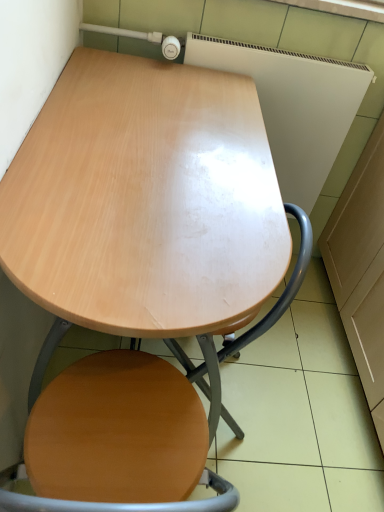
This screenshot has height=512, width=384. What do you see at coordinates (137, 265) in the screenshot?
I see `light wood table at center` at bounding box center [137, 265].

The width and height of the screenshot is (384, 512). I want to click on light wood table at center, so click(x=137, y=265).

In order to face light wood table at center, should I rotate leftwards or rightwards?

Turn left by 6.447 degrees to look at light wood table at center.

What do you see at coordinates (283, 292) in the screenshot? The height and width of the screenshot is (512, 384). I see `wooden swivel chair at center` at bounding box center [283, 292].

The image size is (384, 512). I want to click on wooden swivel chair at center, so click(283, 292).

Find the location of a particular element. light wood table at center is located at coordinates (137, 265).

Considering the relative positions of wooden swivel chair at center and light wood table at center in the image provided, is wooden swivel chair at center to the left of light wood table at center from the viewer's perspective?

No.

Which is behind, wooden swivel chair at center or light wood table at center?

wooden swivel chair at center.

Does point (302, 280) come closer to viewer compared to point (90, 257)?

No, it is not.

From the image's perspective, is wooden swivel chair at center located above or below light wood table at center?

From the image's perspective, wooden swivel chair at center appears below light wood table at center.

From a real-world perspective, is wooden swivel chair at center under light wood table at center?

Indeed, from a real-world perspective, wooden swivel chair at center is positioned beneath light wood table at center.

Based on the photo, is wooden swivel chair at center wider than light wood table at center?

No, wooden swivel chair at center is not wider than light wood table at center.

Considering the sizes of objects wooden swivel chair at center and light wood table at center in the image provided, who is shorter, wooden swivel chair at center or light wood table at center?

wooden swivel chair at center is shorter.

Does wooden swivel chair at center have a smaller size compared to light wood table at center?

Yes.

Is wooden swivel chair at center outside of light wood table at center?

No, most part of wooden swivel chair at center lies within light wood table at center.

Is wooden swivel chair at center with light wood table at center?

No, wooden swivel chair at center is not next to light wood table at center.

Is wooden swivel chair at center looking in the opposite direction of light wood table at center?

Correct, wooden swivel chair at center is looking away from light wood table at center.

How different are the orientations of wooden swivel chair at center and light wood table at center in degrees?

They differ by 1.23 degrees in their facing directions.

At what (x,y) coordinates should I click in order to perform the action: click on table in front of the wooden swivel chair at center. Please return your answer as a coordinate pair (x, y). The image size is (384, 512). Looking at the image, I should click on (137, 265).

Which object is positioned more to the right, light wood table at center or wooden swivel chair at center?

From the viewer's perspective, wooden swivel chair at center appears more on the right side.

Between light wood table at center and wooden swivel chair at center, which one is positioned in front?

Positioned in front is light wood table at center.

Does point (187, 449) lie in front of point (300, 246)?

Yes, it is.

From the image's perspective, would you say light wood table at center is shown under wooden swivel chair at center?

No, from the image's perspective, light wood table at center is not below wooden swivel chair at center.

From a real-world perspective, is light wood table at center located higher than wooden swivel chair at center?

Yes.

Considering the relative sizes of light wood table at center and wooden swivel chair at center in the image provided, is light wood table at center thinner than wooden swivel chair at center?

Incorrect, the width of light wood table at center is not less than that of wooden swivel chair at center.

Between light wood table at center and wooden swivel chair at center, which one has less height?

wooden swivel chair at center is shorter.

Based on their sizes in the image, would you say light wood table at center is bigger or smaller than wooden swivel chair at center?

Clearly, light wood table at center is larger in size than wooden swivel chair at center.

Is light wood table at center inside or outside of wooden swivel chair at center?

light wood table at center is not enclosed by wooden swivel chair at center.

Are light wood table at center and wooden swivel chair at center making contact?

No, light wood table at center is not in contact with wooden swivel chair at center.

Does light wood table at center turn towards wooden swivel chair at center?

Yes, light wood table at center is facing wooden swivel chair at center.

Can you tell me how much light wood table at center and wooden swivel chair at center differ in facing direction?

The facing directions of light wood table at center and wooden swivel chair at center are 1.23 degrees apart.

Image resolution: width=384 pixels, height=512 pixels. Identify the location of swivel chair below the light wood table at center (from the image's perspective). (283, 292).

Where is `table in front of the wooden swivel chair at center`? table in front of the wooden swivel chair at center is located at coordinates (137, 265).

The width and height of the screenshot is (384, 512). What are the coordinates of `swivel chair below the light wood table at center (from the image's perspective)` in the screenshot? It's located at (283, 292).